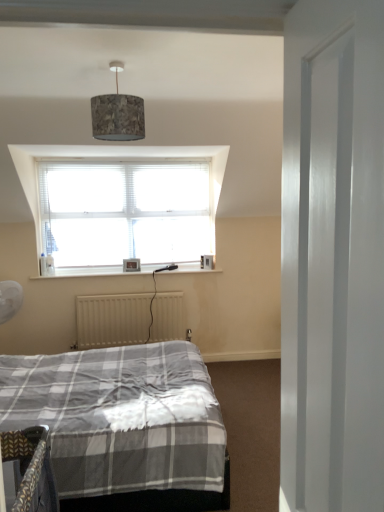
Locate an element on the screen. The height and width of the screenshot is (512, 384). free space above beige matte radiator at lower center (from a real-world perspective) is located at coordinates (114, 292).